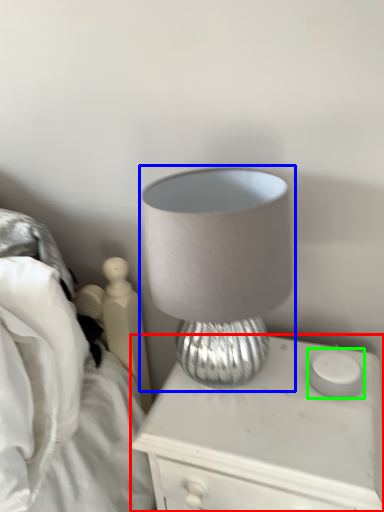
Question: Based on their relative distances, which object is farther from nightstand (highlighted by a red box)? Choose from lamp (highlighted by a blue box) and candle holder (highlighted by a green box).

Choices:
 (A) lamp
 (B) candle holder

Answer: (A)